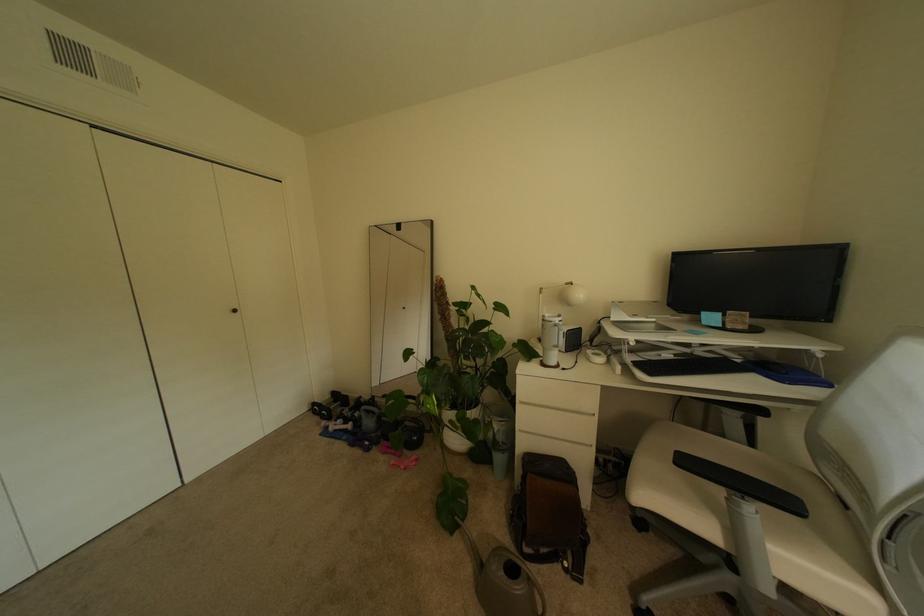
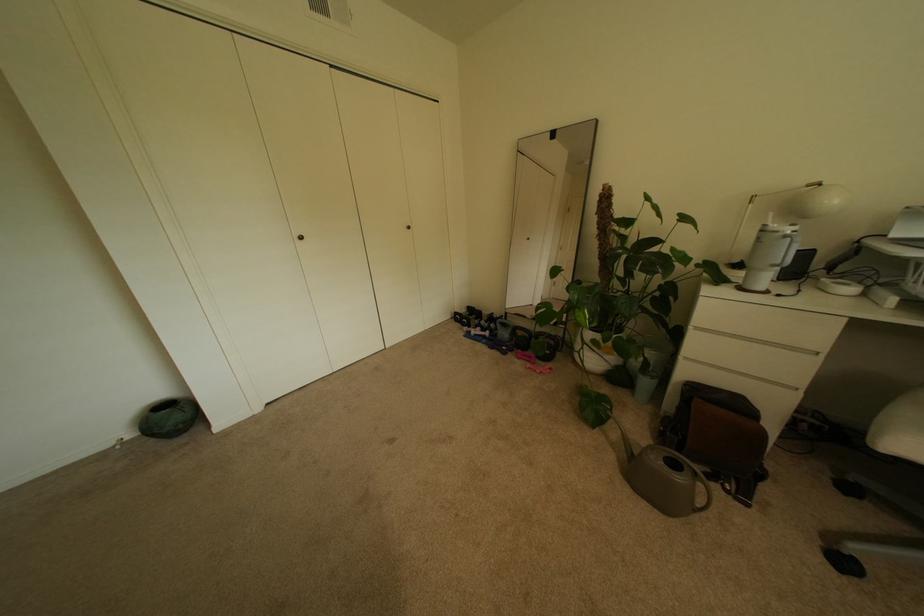
In the second image, find the point that corresponds to the point at 459,423 in the first image.

(602, 342)